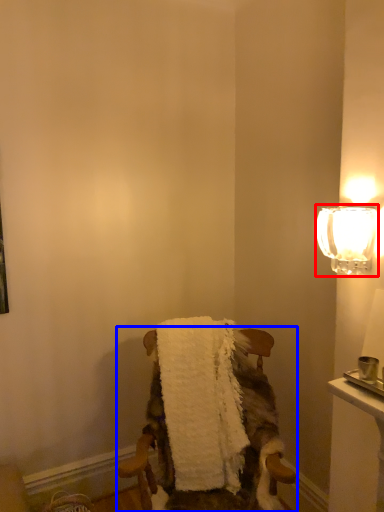
Question: Among these objects, which one is nearest to the camera, lamp (highlighted by a red box) or chair (highlighted by a blue box)?

Choices:
 (A) lamp
 (B) chair

Answer: (A)